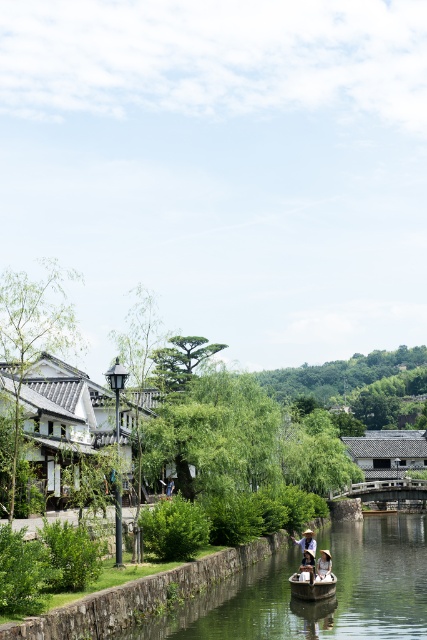
Question: Can you confirm if wooden canoe at lower center is wider than light brown wooden boat at lower center?

Choices:
 (A) no
 (B) yes

Answer: (A)

Question: Which point appears farthest from the camera in this image?

Choices:
 (A) (370, 605)
 (B) (324, 556)

Answer: (B)

Question: Can you confirm if white straw hat at center is smaller than white woven hat at center?

Choices:
 (A) yes
 (B) no

Answer: (B)

Question: Is wooden canoe at lower center closer to camera compared to white woven hat at center?

Choices:
 (A) yes
 (B) no

Answer: (A)

Question: Which object is farther from the camera taking this photo?

Choices:
 (A) smooth brown water at center
 (B) wooden canoe at lower center
 (C) white woven hat at center
 (D) light brown wooden boat at lower center

Answer: (D)

Question: Which object appears closest to the camera in this image?

Choices:
 (A) wooden canoe at lower center
 (B) white straw hat at center
 (C) smooth brown water at center
 (D) light brown wooden boat at lower center

Answer: (C)